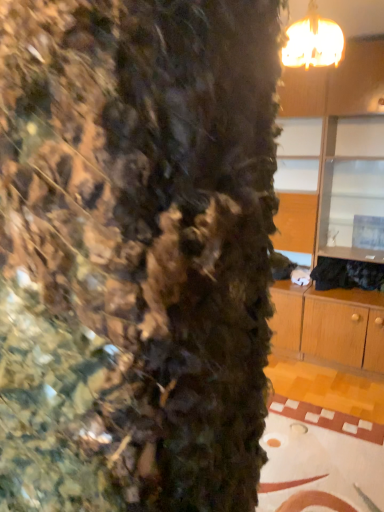
Measure the distance between wooden cabinet at upper right and camera.

They are 3.19 meters apart.

Identify the location of wooden cabinet at upper right. This screenshot has height=512, width=384. (333, 186).

Describe the element at coordinates (333, 186) in the screenshot. I see `wooden cabinet at upper right` at that location.

This screenshot has width=384, height=512. I want to click on matte gold chandelier at upper right, so click(x=313, y=41).

The image size is (384, 512). What do you see at coordinates (313, 41) in the screenshot? I see `matte gold chandelier at upper right` at bounding box center [313, 41].

Measure the distance between point [301,33] and camera.

Point [301,33] and camera are 5.42 feet apart from each other.

At what (x,y) coordinates should I click in order to perform the action: click on wooden cabinet at upper right. Please return your answer as a coordinate pair (x, y). Image resolution: width=384 pixels, height=512 pixels. Looking at the image, I should click on (333, 186).

Between matte gold chandelier at upper right and wooden cabinet at upper right, which one appears on the right side from the viewer's perspective?

Positioned to the right is wooden cabinet at upper right.

Considering their positions, is matte gold chandelier at upper right located in front of or behind wooden cabinet at upper right?

matte gold chandelier at upper right is positioned closer to the viewer than wooden cabinet at upper right.

Considering the positions of point (323, 58) and point (331, 167), is point (323, 58) closer or farther from the camera than point (331, 167)?

Point (323, 58) appears to be closer to the viewer than point (331, 167).

From the image's perspective, is matte gold chandelier at upper right on wooden cabinet at upper right?

Yes, from the image's perspective, matte gold chandelier at upper right is on top of wooden cabinet at upper right.

From a real-world perspective, which object rests below the other?

wooden cabinet at upper right, from a real-world perspective.

Consider the image. Which object is wider, matte gold chandelier at upper right or wooden cabinet at upper right?

With larger width is wooden cabinet at upper right.

From the picture: Considering the sizes of objects matte gold chandelier at upper right and wooden cabinet at upper right in the image provided, who is taller, matte gold chandelier at upper right or wooden cabinet at upper right?

Standing taller between the two is wooden cabinet at upper right.

Considering the sizes of matte gold chandelier at upper right and wooden cabinet at upper right in the image, is matte gold chandelier at upper right bigger or smaller than wooden cabinet at upper right?

Clearly, matte gold chandelier at upper right is smaller in size than wooden cabinet at upper right.

In the scene shown: Does matte gold chandelier at upper right contain wooden cabinet at upper right?

No, wooden cabinet at upper right is not a part of matte gold chandelier at upper right.

Is matte gold chandelier at upper right positioned far away from wooden cabinet at upper right?

Indeed, matte gold chandelier at upper right is not near wooden cabinet at upper right.

Could you tell me if matte gold chandelier at upper right is turned towards wooden cabinet at upper right?

No, matte gold chandelier at upper right is not facing towards wooden cabinet at upper right.

The height and width of the screenshot is (512, 384). Identify the location of dresser that appears below the matte gold chandelier at upper right (from a real-world perspective). (333, 186).

Which object is positioned more to the right, wooden cabinet at upper right or matte gold chandelier at upper right?

wooden cabinet at upper right.

Is the depth of wooden cabinet at upper right less than that of matte gold chandelier at upper right?

No, wooden cabinet at upper right is further to the viewer.

Is point (299, 119) closer or farther from the camera than point (309, 30)?

Point (299, 119) appears to be farther away from the viewer than point (309, 30).

From the image's perspective, is wooden cabinet at upper right above matte gold chandelier at upper right?

Incorrect, from the image's perspective, wooden cabinet at upper right is lower than matte gold chandelier at upper right.

From the picture: From a real-world perspective, between wooden cabinet at upper right and matte gold chandelier at upper right, who is vertically lower?

wooden cabinet at upper right is physically lower.

Can you confirm if wooden cabinet at upper right is thinner than matte gold chandelier at upper right?

No, wooden cabinet at upper right is not thinner than matte gold chandelier at upper right.

Can you confirm if wooden cabinet at upper right is shorter than matte gold chandelier at upper right?

Incorrect, the height of wooden cabinet at upper right does not fall short of that of matte gold chandelier at upper right.

Does wooden cabinet at upper right have a smaller size compared to matte gold chandelier at upper right?

No.

In the scene shown: Can we say wooden cabinet at upper right lies outside matte gold chandelier at upper right?

Absolutely, wooden cabinet at upper right is external to matte gold chandelier at upper right.

Is wooden cabinet at upper right not close to matte gold chandelier at upper right?

Yes, wooden cabinet at upper right and matte gold chandelier at upper right are quite far apart.

Is wooden cabinet at upper right oriented towards matte gold chandelier at upper right?

Yes.

How different are the orientations of wooden cabinet at upper right and matte gold chandelier at upper right in degrees?

89.7 degrees.

Measure the distance between wooden cabinet at upper right and matte gold chandelier at upper right.

A distance of 5.25 feet exists between wooden cabinet at upper right and matte gold chandelier at upper right.

At what (x,y) coordinates should I click in order to perform the action: click on dresser lying on the right of matte gold chandelier at upper right. Please return your answer as a coordinate pair (x, y). The height and width of the screenshot is (512, 384). Looking at the image, I should click on (333, 186).

Identify the location of lamp lying on the left of wooden cabinet at upper right. (313, 41).

Where is `lamp above the wooden cabinet at upper right (from a real-world perspective)`? lamp above the wooden cabinet at upper right (from a real-world perspective) is located at coordinates (313, 41).